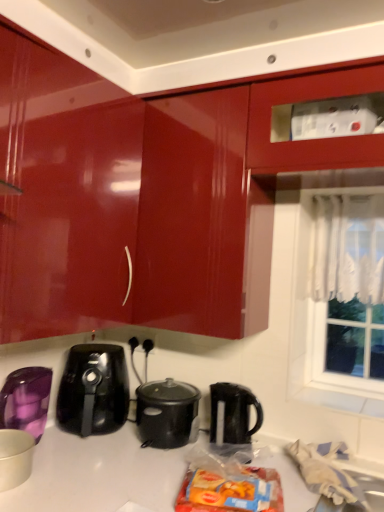
The height and width of the screenshot is (512, 384). I want to click on free space above white lace curtain at right (from a real-world perspective), so click(351, 194).